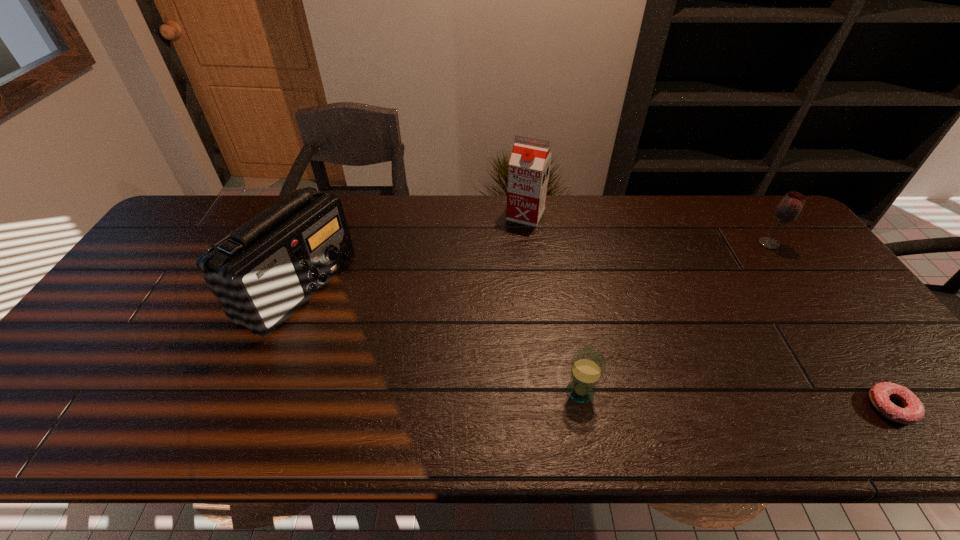
I want to click on vacant point that satisfies the following two spatial constraints: 1. on the front panel of the leftmost object; 2. on the back side of the shortest object, so click(250, 407).

You are a GUI agent. You are given a task and a screenshot of the screen. Output one action in this format:
    pyautogui.click(x=<x>, y=<y>)
    Task: Click on the free space that satisfies the following two spatial constraints: 1. on the front side of the third shortest object; 2. on the front panel of the leftmost object
    
    Given the screenshot: What is the action you would take?
    pyautogui.click(x=800, y=288)

Locate an element on the screen. The image size is (960, 540). vacant space that satisfies the following two spatial constraints: 1. on the front panel of the radio receiver; 2. on the back side of the doughnut is located at coordinates (250, 407).